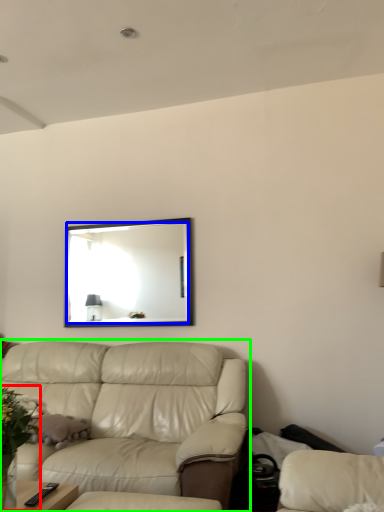
Question: Which object is the farthest from floral arrangement (highlighted by a red box)? Choose among these: mirror (highlighted by a blue box) or studio couch (highlighted by a green box).

Choices:
 (A) mirror
 (B) studio couch

Answer: (A)